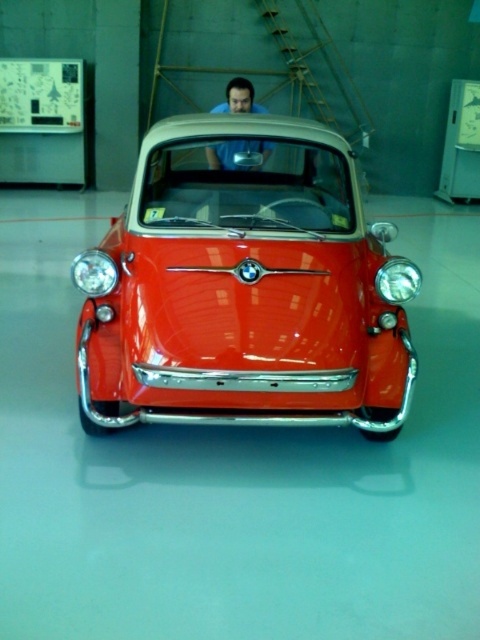
Question: Is the position of shiny red car at center less distant than that of blue matte shirt at center?

Choices:
 (A) no
 (B) yes

Answer: (B)

Question: Does shiny red car at center appear on the left side of blue matte shirt at center?

Choices:
 (A) yes
 (B) no

Answer: (B)

Question: Which of the following is the closest to the observer?

Choices:
 (A) shiny red car at center
 (B) blue matte shirt at center

Answer: (A)

Question: Which of the following is the closest to the observer?

Choices:
 (A) (363, 228)
 (B) (245, 93)

Answer: (A)

Question: Considering the relative positions of shiny red car at center and blue matte shirt at center in the image provided, where is shiny red car at center located with respect to blue matte shirt at center?

Choices:
 (A) right
 (B) left

Answer: (A)